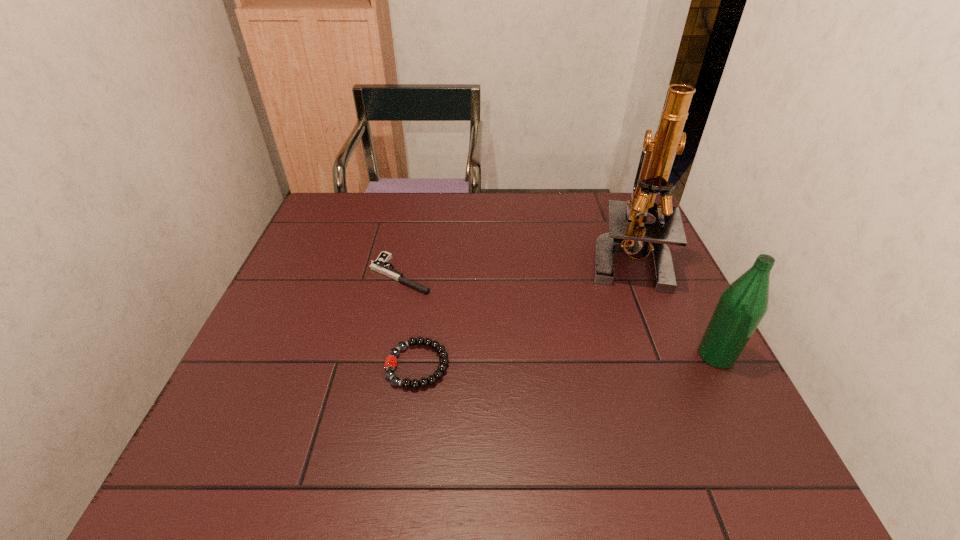
Image resolution: width=960 pixels, height=540 pixels. Identify the location of free space on the desktop that is between the third tallest object and the second tallest object and is positioned at the eyepiece of the tallest object. 549,361.

This screenshot has width=960, height=540. I want to click on free space on the desktop that is between the third tallest object and the third shortest object and is positioned on the front-facing side of the shortest object, so click(595, 360).